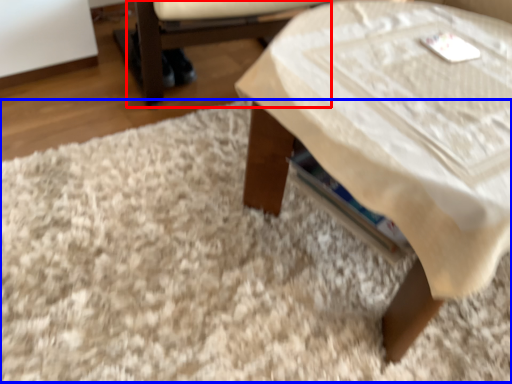
Question: Among these objects, which one is farthest to the camera, armchair (highlighted by a red box) or mat (highlighted by a blue box)?

Choices:
 (A) armchair
 (B) mat

Answer: (A)